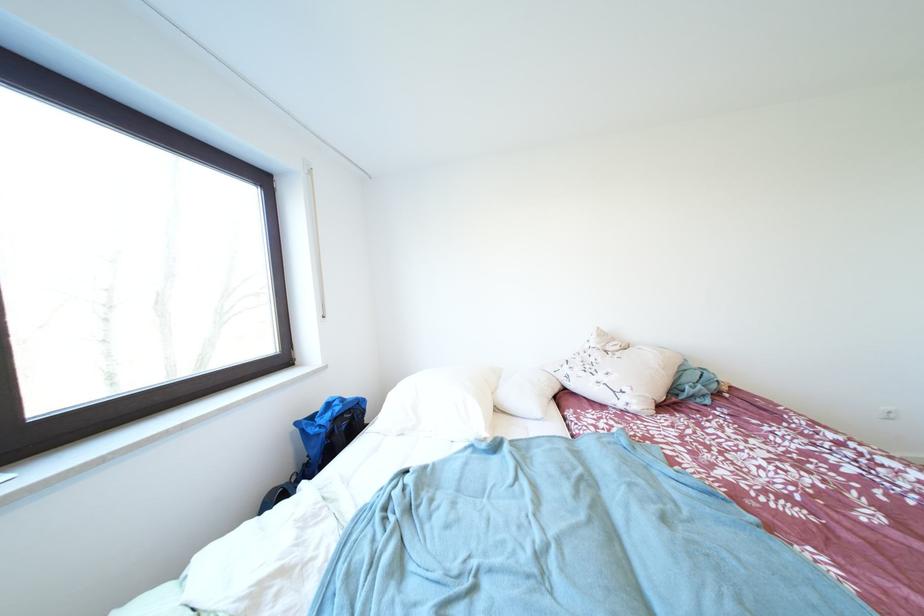
Image resolution: width=924 pixels, height=616 pixels. In order to click on patterned pillow in this screenshot , I will do `click(617, 373)`.